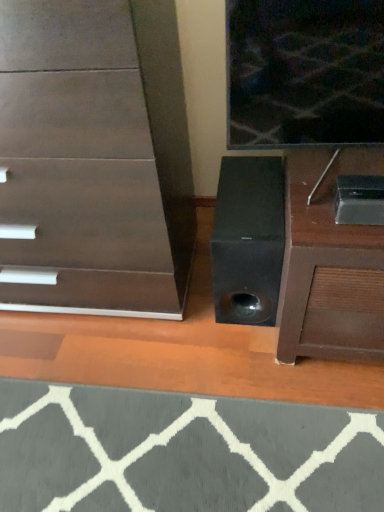
Find the location of `metallic silver speaker at lower right`. metallic silver speaker at lower right is located at coordinates (329, 264).

Is metallic silver speaker at lower right facing towards dark wood chest of drawers at center?

No, metallic silver speaker at lower right is not aimed at dark wood chest of drawers at center.

From the image's perspective, does metallic silver speaker at lower right appear higher than dark wood chest of drawers at center?

No, from the image's perspective, metallic silver speaker at lower right is not above dark wood chest of drawers at center.

Can you tell me how much metallic silver speaker at lower right and dark wood chest of drawers at center differ in facing direction?

1.43 degrees separate the facing orientations of metallic silver speaker at lower right and dark wood chest of drawers at center.

Looking at their sizes, would you say metallic silver speaker at lower right is wider or thinner than dark wood chest of drawers at center?

In the image, metallic silver speaker at lower right appears to be more narrow than dark wood chest of drawers at center.

From a real-world perspective, between gray woolen doormat at lower center and metallic silver speaker at lower right, who is vertically lower?

In real-world perspective, gray woolen doormat at lower center is lower.

Which object is wider, gray woolen doormat at lower center or metallic silver speaker at lower right?

Wider between the two is gray woolen doormat at lower center.

Between gray woolen doormat at lower center and metallic silver speaker at lower right, which one has smaller size?

gray woolen doormat at lower center.

Between gray woolen doormat at lower center and metallic silver speaker at lower right, which one has less height?

Standing shorter between the two is gray woolen doormat at lower center.

Considering the sizes of objects dark wood chest of drawers at center and gray woolen doormat at lower center in the image provided, who is wider, dark wood chest of drawers at center or gray woolen doormat at lower center?

With larger width is gray woolen doormat at lower center.

Considering the relative sizes of dark wood chest of drawers at center and gray woolen doormat at lower center in the image provided, is dark wood chest of drawers at center smaller than gray woolen doormat at lower center?

No, dark wood chest of drawers at center is not smaller than gray woolen doormat at lower center.

Would you consider dark wood chest of drawers at center to be distant from gray woolen doormat at lower center?

dark wood chest of drawers at center is actually quite close to gray woolen doormat at lower center.

Identify the location of doormat below the metallic silver speaker at lower right (from a real-world perspective). This screenshot has width=384, height=512. (182, 452).

From a real-world perspective, who is located higher, metallic silver speaker at lower right or gray woolen doormat at lower center?

metallic silver speaker at lower right, from a real-world perspective.

In the scene shown: Considering the sizes of metallic silver speaker at lower right and gray woolen doormat at lower center in the image, is metallic silver speaker at lower right wider or thinner than gray woolen doormat at lower center?

Considering their sizes, metallic silver speaker at lower right looks slimmer than gray woolen doormat at lower center.

Which point is more distant from viewer, (330, 240) or (174, 450)?

The point (174, 450) is farther from the camera.

Is point (17, 208) closer or farther from the camera than point (285, 331)?

Point (17, 208).

Which of these two, dark wood chest of drawers at center or metallic silver speaker at lower right, is thinner?

Thinner between the two is metallic silver speaker at lower right.

From a real-world perspective, relative to metallic silver speaker at lower right, is dark wood chest of drawers at center vertically above or below?

Clearly, from a real-world perspective, dark wood chest of drawers at center is above metallic silver speaker at lower right.

From the image's perspective, is dark wood chest of drawers at center on top of metallic silver speaker at lower right?

Indeed, from the image's perspective, dark wood chest of drawers at center is shown above metallic silver speaker at lower right.

Considering the positions of objects gray woolen doormat at lower center and dark wood chest of drawers at center in the image provided, who is more to the right, gray woolen doormat at lower center or dark wood chest of drawers at center?

From the viewer's perspective, gray woolen doormat at lower center appears more on the right side.

Can you confirm if gray woolen doormat at lower center is shorter than dark wood chest of drawers at center?

Indeed, gray woolen doormat at lower center has a lesser height compared to dark wood chest of drawers at center.

Which object is further away from the camera, gray woolen doormat at lower center or dark wood chest of drawers at center?

gray woolen doormat at lower center is more distant.

Is gray woolen doormat at lower center oriented towards dark wood chest of drawers at center?

No, gray woolen doormat at lower center is not turned towards dark wood chest of drawers at center.

Locate an element on the screen. This screenshot has width=384, height=512. furniture lying on the right of dark wood chest of drawers at center is located at coordinates (329, 264).

At what (x,y) coordinates should I click in order to perform the action: click on doormat below the metallic silver speaker at lower right (from the image's perspective). Please return your answer as a coordinate pair (x, y). Looking at the image, I should click on (182, 452).

When comparing their distances from dark wood chest of drawers at center, does metallic silver speaker at lower right or gray woolen doormat at lower center seem further?

gray woolen doormat at lower center lies further to dark wood chest of drawers at center than the other object.

Based on their spatial positions, is dark wood chest of drawers at center or gray woolen doormat at lower center closer to metallic silver speaker at lower right?

Based on the image, gray woolen doormat at lower center appears to be nearer to metallic silver speaker at lower right.

Which object lies nearer to the anchor point gray woolen doormat at lower center, metallic silver speaker at lower right or dark wood chest of drawers at center?

metallic silver speaker at lower right.

From the image, which object appears to be farther from metallic silver speaker at lower right, gray woolen doormat at lower center or dark wood chest of drawers at center?

dark wood chest of drawers at center is positioned further to the anchor metallic silver speaker at lower right.

From the image, which object appears to be nearer to dark wood chest of drawers at center, gray woolen doormat at lower center or metallic silver speaker at lower right?

Based on the image, metallic silver speaker at lower right appears to be nearer to dark wood chest of drawers at center.

Looking at the image, which one is located closer to gray woolen doormat at lower center, dark wood chest of drawers at center or metallic silver speaker at lower right?

metallic silver speaker at lower right lies closer to gray woolen doormat at lower center than the other object.

This screenshot has width=384, height=512. In order to click on furniture that lies between dark wood chest of drawers at center and gray woolen doormat at lower center from top to bottom in this screenshot , I will do `click(329, 264)`.